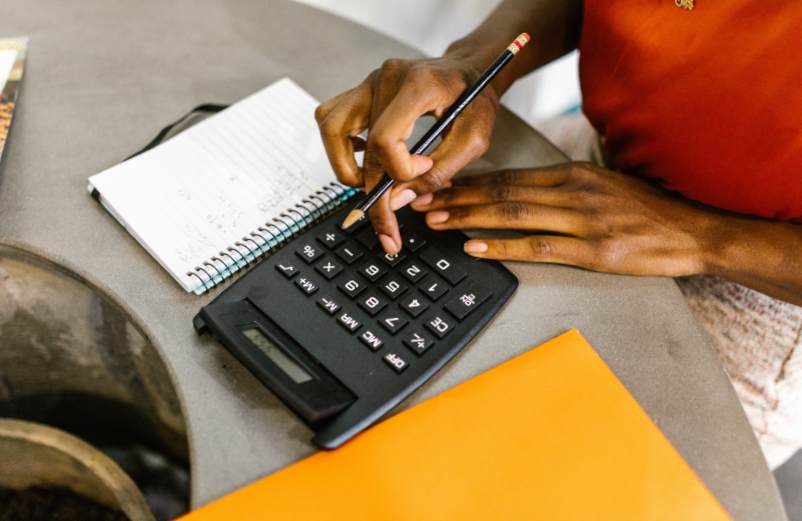
Find the location of `notepad`. notepad is located at coordinates (239, 192).